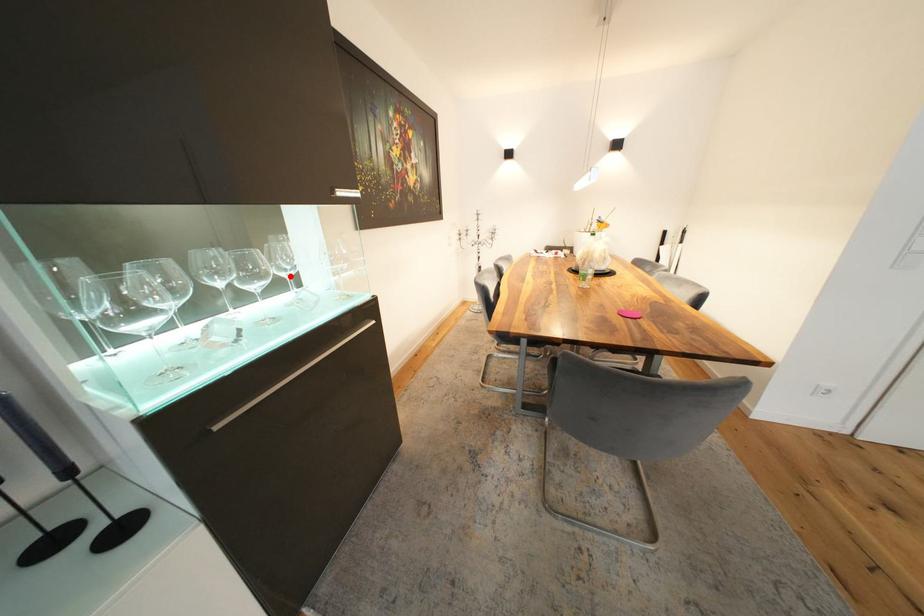
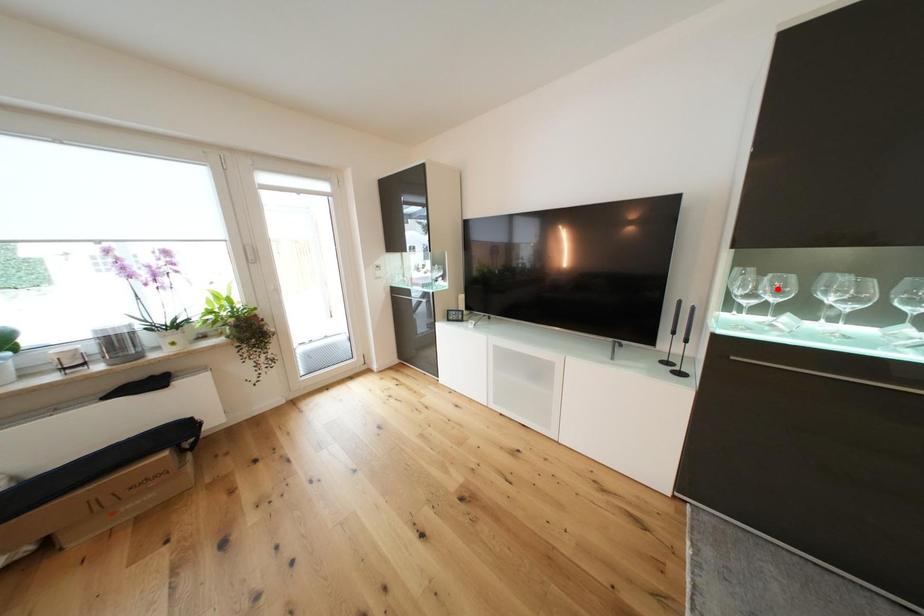
I am providing you with two images of the same scene from different viewpoints. A red point is marked on the first image and another point is marked on the second image. Are the points marked in image1 and image2 representing the same 3D position?

No